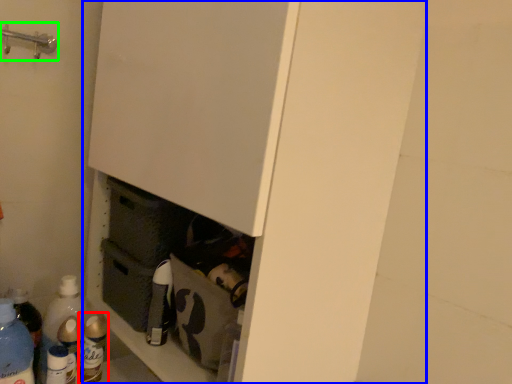
Question: Estimate the real-world distances between objects in this image. Which object is farther from bottle (highlighted by a red box), cupboard (highlighted by a blue box) or door handle (highlighted by a green box)?

Choices:
 (A) cupboard
 (B) door handle

Answer: (B)